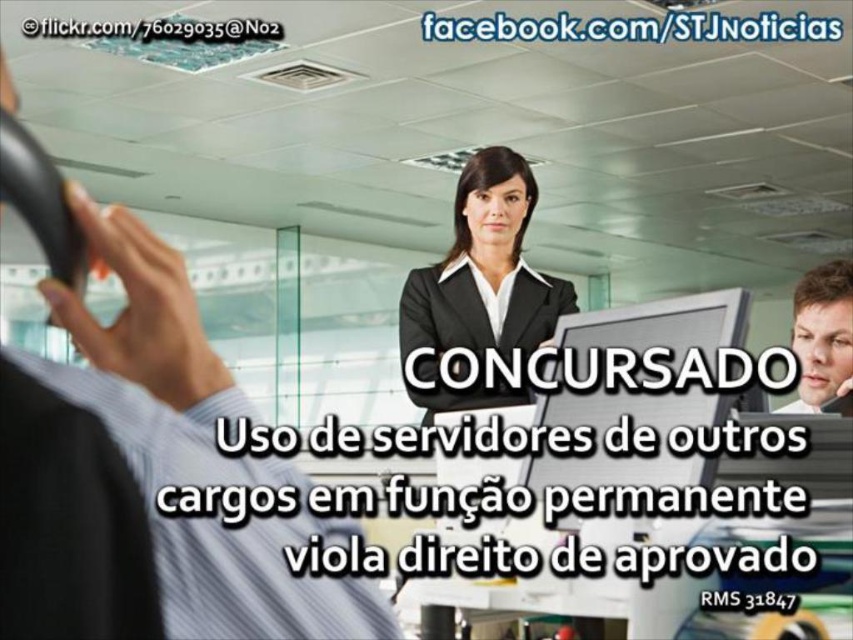
You are an office assistant who needs to place a new monitor on the desk. The desk currently has a black matte suit at center and a matte black monitor at center. Which object should you move to make space?

The black matte suit at center is above the matte black monitor at center, so you should move the black matte suit at center to access the monitor below and make space for the new monitor.

You are an office assistant who needs to adjust the position of the matte black monitor at center so it doesn not block the smooth skin face at center in the video conference. Given their size difference, which object should be moved closer to the camera?

The matte black monitor at center should be moved closer to the camera since it is smaller than the smooth skin face at center, allowing it to appear larger in the frame and avoid blocking the face.